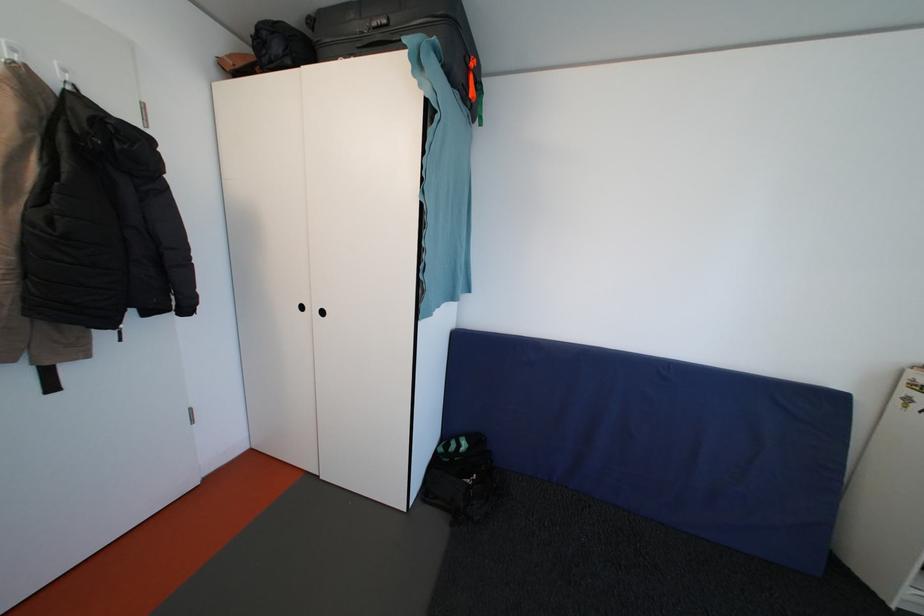
Where would you lift the black bag? Please return your answer as a coordinate pair (x, y).

(473, 499)